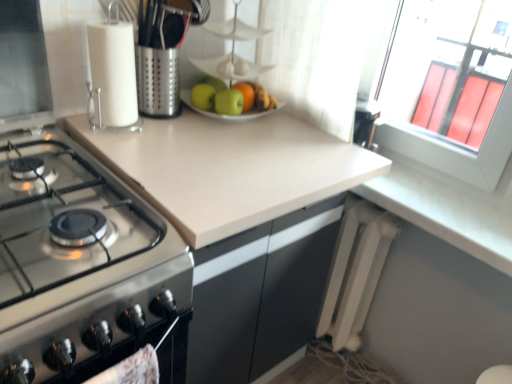
At what (x,y) coordinates should I click in order to perform the action: click on vacant space to the right of white paper towel holder at upper left. Please return your answer as a coordinate pair (x, y). The width and height of the screenshot is (512, 384). Looking at the image, I should click on (178, 134).